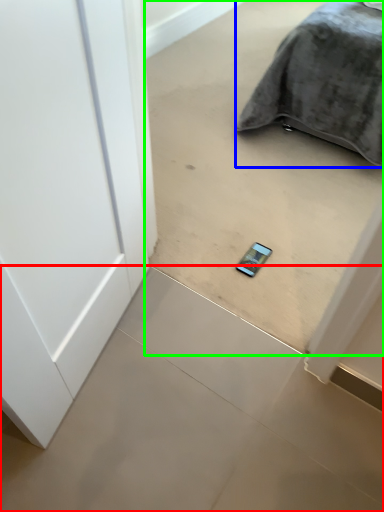
Question: Considering the real-world distances, which object is farthest from concrete (highlighted by a red box)? furniture (highlighted by a blue box) or concrete (highlighted by a green box)?

Choices:
 (A) furniture
 (B) concrete

Answer: (A)